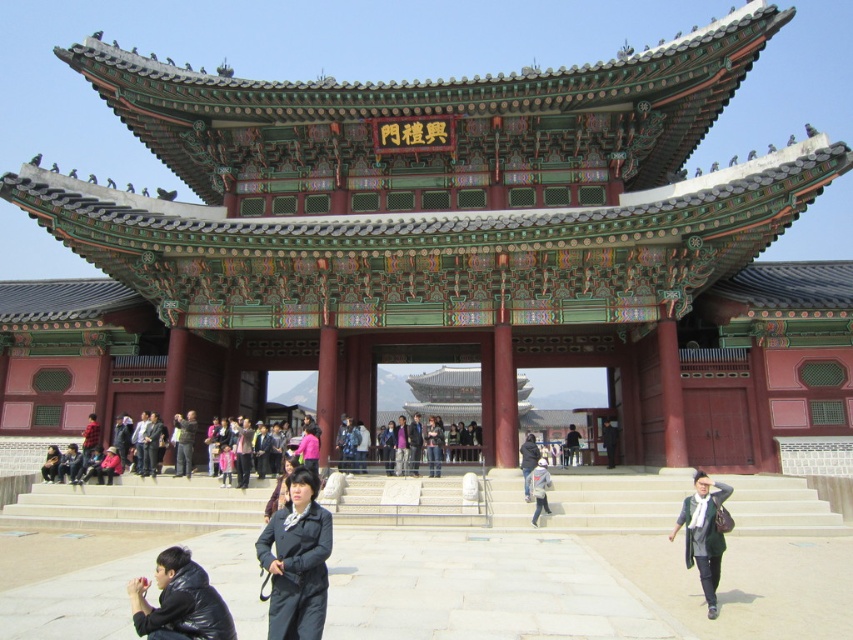
Question: Can you confirm if smooth stone stairs at center is positioned above black leather jacket at lower left?

Choices:
 (A) no
 (B) yes

Answer: (A)

Question: Which object is the closest to the green painted wood gate at center?

Choices:
 (A) dark blue fabric jacket at center
 (B) dark blue jeans at center

Answer: (B)

Question: Is dark blue jeans at center positioned at the back of dark blue fabric jacket at center?

Choices:
 (A) yes
 (B) no

Answer: (B)

Question: Does black leather jacket at lower left have a smaller size compared to dark blue fabric jacket at center?

Choices:
 (A) no
 (B) yes

Answer: (B)

Question: Which object is positioned farthest from the gray fabric jacket at center?

Choices:
 (A) smooth stone stairs at center
 (B) purple fabric jacket at center
 (C) green painted wood gate at center

Answer: (C)

Question: Which point is closer to the camera taking this photo?

Choices:
 (A) (534, 483)
 (B) (16, 499)
 (C) (3, 403)
 (D) (323, 604)

Answer: (D)